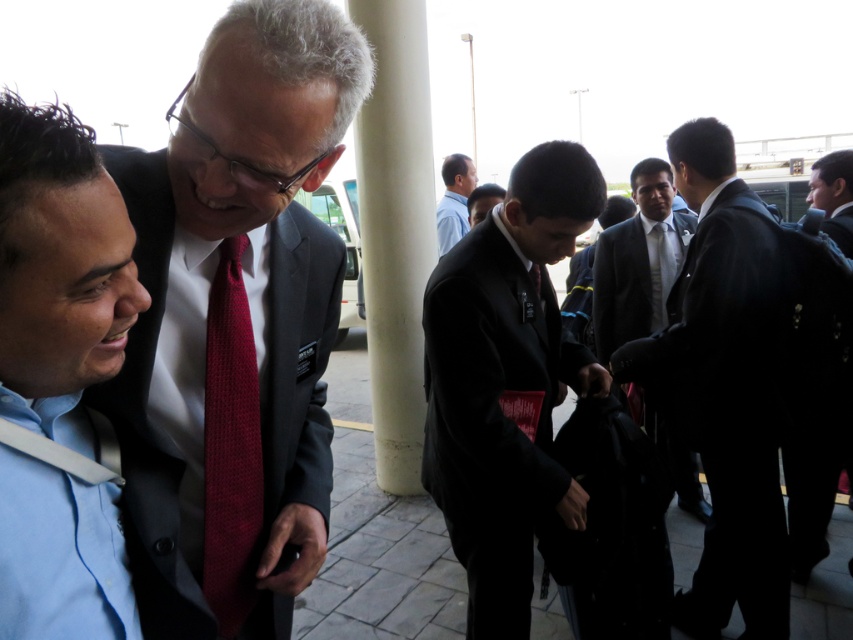
Question: Which point is farther from the camera taking this photo?

Choices:
 (A) (848, 172)
 (B) (207, 432)

Answer: (A)

Question: Which point appears closest to the camera in this image?

Choices:
 (A) (610, 324)
 (B) (450, 403)
 (C) (57, 420)
 (D) (767, 349)

Answer: (C)

Question: Is black wool coat at right below dark blue suit at center?

Choices:
 (A) no
 (B) yes

Answer: (B)

Question: Which point is farther to the camera?

Choices:
 (A) (219, 340)
 (B) (463, 156)

Answer: (B)

Question: Is light blue shirt at left thinner than blue shirt at center?

Choices:
 (A) yes
 (B) no

Answer: (A)

Question: Can you confirm if matte black suit at center is smaller than dark gray suit at center?

Choices:
 (A) yes
 (B) no

Answer: (A)